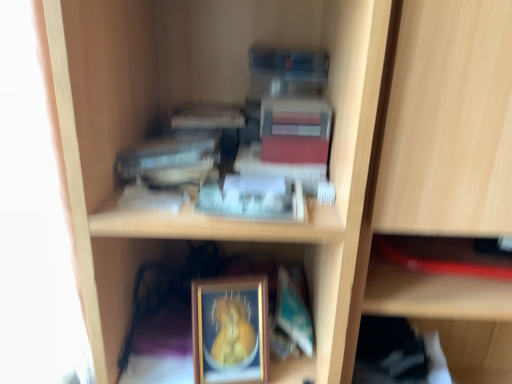
The height and width of the screenshot is (384, 512). Describe the element at coordinates (169, 158) in the screenshot. I see `hardcover book at upper center, acting as the first paperback book starting from the left` at that location.

The height and width of the screenshot is (384, 512). What do you see at coordinates (295, 130) in the screenshot? I see `matte red paperback book at upper center, arranged as the 3th paperback book when ordered from the bottom` at bounding box center [295, 130].

You are a GUI agent. You are given a task and a screenshot of the screen. Output one action in this format:
    pyautogui.click(x=<x>, y=<y>)
    Task: Click on the gold-framed picture at lower center
    This screenshot has width=512, height=384.
    Given the screenshot: What is the action you would take?
    pyautogui.click(x=230, y=330)

The height and width of the screenshot is (384, 512). Find the location of `hardcover book at upper center, marked as the third paperback book in a right-to-left arrangement`. hardcover book at upper center, marked as the third paperback book in a right-to-left arrangement is located at coordinates (169, 158).

From the image's perspective, between matte red paperback book at upper center, the 1th paperback book when ordered from top to bottom, and gold-framed picture at lower center, which one is located above?

matte red paperback book at upper center, the 1th paperback book when ordered from top to bottom.

Which is in front, matte red paperback book at upper center, arranged as the 3th paperback book when ordered from the bottom, or gold-framed picture at lower center?

matte red paperback book at upper center, arranged as the 3th paperback book when ordered from the bottom, is closer to the camera.

Considering the positions of objects matte red paperback book at upper center, the 2th paperback book in the right-to-left sequence, and gold-framed picture at lower center in the image provided, who is more to the right, matte red paperback book at upper center, the 2th paperback book in the right-to-left sequence, or gold-framed picture at lower center?

matte red paperback book at upper center, the 2th paperback book in the right-to-left sequence.

From a real-world perspective, which object stands above the other?

matte red paperback book at upper center, marked as the second paperback book in a left-to-right arrangement.

From a real-world perspective, which object rests below the other?

In real-world perspective, teal matte paperback book at lower center, which appears as the first paperback book when ordered from the bottom, is lower.

Where is `paperback book located below the hardcover book at upper center, which is the second paperback book in bottom-to-top order (from the image's perspective)`? paperback book located below the hardcover book at upper center, which is the second paperback book in bottom-to-top order (from the image's perspective) is located at coordinates (293, 313).

Looking at this image, which of these two, hardcover book at upper center, which is the second paperback book in bottom-to-top order, or teal matte paperback book at lower center, the 1th paperback book in the right-to-left sequence, stands taller?

Standing taller between the two is teal matte paperback book at lower center, the 1th paperback book in the right-to-left sequence.

Considering the relative positions of hardcover book at upper center, marked as the third paperback book in a right-to-left arrangement, and teal matte paperback book at lower center, marked as the third paperback book in a left-to-right arrangement, in the image provided, is hardcover book at upper center, marked as the third paperback book in a right-to-left arrangement, in front of teal matte paperback book at lower center, marked as the third paperback book in a left-to-right arrangement,?

Yes, it is in front of teal matte paperback book at lower center, marked as the third paperback book in a left-to-right arrangement.

Is teal matte paperback book at lower center, the 1th paperback book in the right-to-left sequence, smaller than gold-framed picture at lower center?

Incorrect, teal matte paperback book at lower center, the 1th paperback book in the right-to-left sequence, is not smaller in size than gold-framed picture at lower center.

Does teal matte paperback book at lower center, which appears as the first paperback book when ordered from the bottom, appear on the left side of gold-framed picture at lower center?

No, teal matte paperback book at lower center, which appears as the first paperback book when ordered from the bottom, is not to the left of gold-framed picture at lower center.

From the image's perspective, is teal matte paperback book at lower center, marked as the third paperback book in a left-to-right arrangement, located beneath gold-framed picture at lower center?

Incorrect, from the image's perspective, teal matte paperback book at lower center, marked as the third paperback book in a left-to-right arrangement, is higher than gold-framed picture at lower center.

From a real-world perspective, which is physically below, teal matte paperback book at lower center, which appears as the first paperback book when ordered from the bottom, or gold-framed picture at lower center?

In real-world perspective, teal matte paperback book at lower center, which appears as the first paperback book when ordered from the bottom, is lower.

Which is behind, point (261, 376) or point (278, 273)?

Point (278, 273)

Is gold-framed picture at lower center turned away from teal matte paperback book at lower center, which appears as the first paperback book when ordered from the bottom?

That's not correct — gold-framed picture at lower center is not looking away from teal matte paperback book at lower center, which appears as the first paperback book when ordered from the bottom.

How many degrees apart are the facing directions of gold-framed picture at lower center and teal matte paperback book at lower center, the 1th paperback book in the right-to-left sequence?

They differ by 10.9 degrees in their facing directions.

From the image's perspective, is matte red paperback book at upper center, marked as the second paperback book in a left-to-right arrangement, above or below hardcover book at upper center, which is the second paperback book from top to bottom?

matte red paperback book at upper center, marked as the second paperback book in a left-to-right arrangement, is situated higher than hardcover book at upper center, which is the second paperback book from top to bottom, in the image.

From the picture: From their relative heights in the image, would you say matte red paperback book at upper center, marked as the second paperback book in a left-to-right arrangement, is taller or shorter than hardcover book at upper center, which is the second paperback book in bottom-to-top order?

Clearly, matte red paperback book at upper center, marked as the second paperback book in a left-to-right arrangement, is taller compared to hardcover book at upper center, which is the second paperback book in bottom-to-top order.

Is matte red paperback book at upper center, marked as the second paperback book in a left-to-right arrangement, aimed at hardcover book at upper center, marked as the third paperback book in a right-to-left arrangement?

No, matte red paperback book at upper center, marked as the second paperback book in a left-to-right arrangement, is not aimed at hardcover book at upper center, marked as the third paperback book in a right-to-left arrangement.

Is matte red paperback book at upper center, arranged as the 3th paperback book when ordered from the bottom, not close to hardcover book at upper center, which is the second paperback book from top to bottom?

No, matte red paperback book at upper center, arranged as the 3th paperback book when ordered from the bottom, is not far from hardcover book at upper center, which is the second paperback book from top to bottom.

Is hardcover book at upper center, marked as the third paperback book in a right-to-left arrangement, taller than matte red paperback book at upper center, the 2th paperback book in the right-to-left sequence?

No.

From the picture: Considering their positions, is hardcover book at upper center, which is the second paperback book from top to bottom, located in front of or behind matte red paperback book at upper center, the 2th paperback book in the right-to-left sequence?

In the image, hardcover book at upper center, which is the second paperback book from top to bottom, appears in front of matte red paperback book at upper center, the 2th paperback book in the right-to-left sequence.

From the image's perspective, which one is positioned higher, hardcover book at upper center, acting as the first paperback book starting from the left, or matte red paperback book at upper center, the 1th paperback book when ordered from top to bottom?

matte red paperback book at upper center, the 1th paperback book when ordered from top to bottom, from the image's perspective.

Can you confirm if teal matte paperback book at lower center, which appears as the first paperback book when ordered from the bottom, is wider than hardcover book at upper center, marked as the third paperback book in a right-to-left arrangement?

Indeed, teal matte paperback book at lower center, which appears as the first paperback book when ordered from the bottom, has a greater width compared to hardcover book at upper center, marked as the third paperback book in a right-to-left arrangement.

Which is more to the left, teal matte paperback book at lower center, the 1th paperback book in the right-to-left sequence, or hardcover book at upper center, which is the second paperback book from top to bottom?

Positioned to the left is hardcover book at upper center, which is the second paperback book from top to bottom.

Is the depth of teal matte paperback book at lower center, the 1th paperback book in the right-to-left sequence, greater than that of hardcover book at upper center, which is the second paperback book in bottom-to-top order?

Yes, it is behind hardcover book at upper center, which is the second paperback book in bottom-to-top order.

At what (x,y) coordinates should I click in order to perform the action: click on picture frame beneath the matte red paperback book at upper center, arranged as the 3th paperback book when ordered from the bottom (from a real-world perspective). Please return your answer as a coordinate pair (x, y). The height and width of the screenshot is (384, 512). Looking at the image, I should click on (230, 330).

Locate an element on the screen. The image size is (512, 384). the 2nd paperback book to the right when counting from the hardcover book at upper center, acting as the first paperback book starting from the left is located at coordinates (293, 313).

Which object lies further to the anchor point teal matte paperback book at lower center, marked as the third paperback book in a left-to-right arrangement, hardcover book at upper center, marked as the third paperback book in a right-to-left arrangement, or gold-framed picture at lower center?

Based on the image, hardcover book at upper center, marked as the third paperback book in a right-to-left arrangement, appears to be further to teal matte paperback book at lower center, marked as the third paperback book in a left-to-right arrangement.

Consider the image. When comparing their distances from hardcover book at upper center, marked as the third paperback book in a right-to-left arrangement, does gold-framed picture at lower center or matte red paperback book at upper center, the 1th paperback book when ordered from top to bottom, seem further?

gold-framed picture at lower center is further to hardcover book at upper center, marked as the third paperback book in a right-to-left arrangement.

Which object lies further to the anchor point teal matte paperback book at lower center, which is counted as the 3th paperback book, starting from the top, hardcover book at upper center, which is the second paperback book from top to bottom, or matte red paperback book at upper center, arranged as the 3th paperback book when ordered from the bottom?

Based on the image, hardcover book at upper center, which is the second paperback book from top to bottom, appears to be further to teal matte paperback book at lower center, which is counted as the 3th paperback book, starting from the top.

Looking at the image, which one is located further to hardcover book at upper center, which is the second paperback book in bottom-to-top order, gold-framed picture at lower center or teal matte paperback book at lower center, the 1th paperback book in the right-to-left sequence?

teal matte paperback book at lower center, the 1th paperback book in the right-to-left sequence, is further to hardcover book at upper center, which is the second paperback book in bottom-to-top order.

Which object lies nearer to the anchor point matte red paperback book at upper center, marked as the second paperback book in a left-to-right arrangement, teal matte paperback book at lower center, which is counted as the 3th paperback book, starting from the top, or gold-framed picture at lower center?

gold-framed picture at lower center is positioned closer to the anchor matte red paperback book at upper center, marked as the second paperback book in a left-to-right arrangement.

Which object lies nearer to the anchor point matte red paperback book at upper center, the 1th paperback book when ordered from top to bottom, hardcover book at upper center, which is the second paperback book from top to bottom, or teal matte paperback book at lower center, which appears as the first paperback book when ordered from the bottom?

Among the two, hardcover book at upper center, which is the second paperback book from top to bottom, is located nearer to matte red paperback book at upper center, the 1th paperback book when ordered from top to bottom.

From the image, which object appears to be nearer to hardcover book at upper center, which is the second paperback book from top to bottom, teal matte paperback book at lower center, which is counted as the 3th paperback book, starting from the top, or gold-framed picture at lower center?

gold-framed picture at lower center is closer to hardcover book at upper center, which is the second paperback book from top to bottom.

Based on their spatial positions, is teal matte paperback book at lower center, which appears as the first paperback book when ordered from the bottom, or hardcover book at upper center, which is the second paperback book in bottom-to-top order, further from matte red paperback book at upper center, the 1th paperback book when ordered from top to bottom?

teal matte paperback book at lower center, which appears as the first paperback book when ordered from the bottom, is positioned further to the anchor matte red paperback book at upper center, the 1th paperback book when ordered from top to bottom.

The width and height of the screenshot is (512, 384). Find the location of `paperback book that lies between matte red paperback book at upper center, the 1th paperback book when ordered from top to bottom, and teal matte paperback book at lower center, the 1th paperback book in the right-to-left sequence, from top to bottom`. paperback book that lies between matte red paperback book at upper center, the 1th paperback book when ordered from top to bottom, and teal matte paperback book at lower center, the 1th paperback book in the right-to-left sequence, from top to bottom is located at coordinates [x=169, y=158].

Image resolution: width=512 pixels, height=384 pixels. Identify the location of paperback book between hardcover book at upper center, which is the second paperback book in bottom-to-top order, and gold-framed picture at lower center from top to bottom. (293, 313).